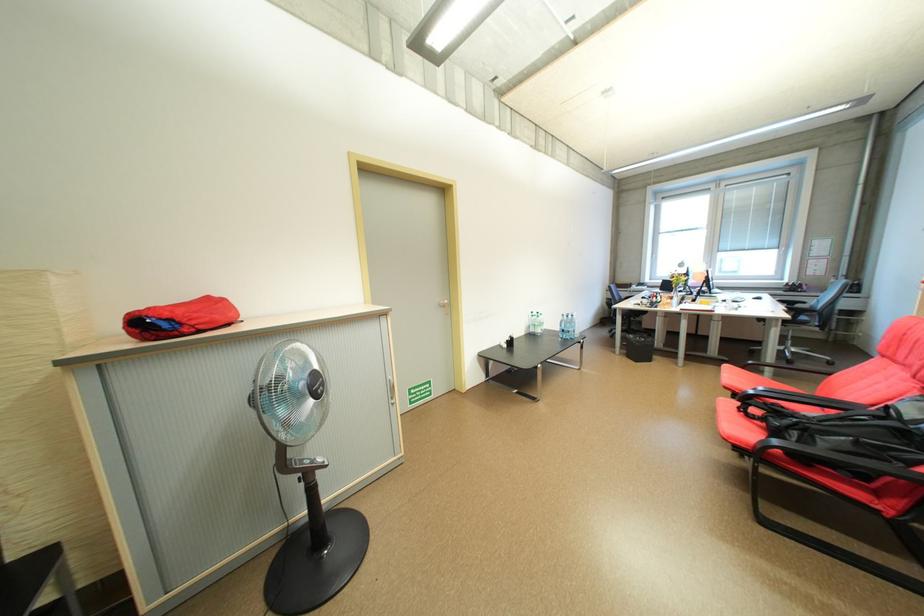
I want to click on fan button, so click(x=311, y=468).